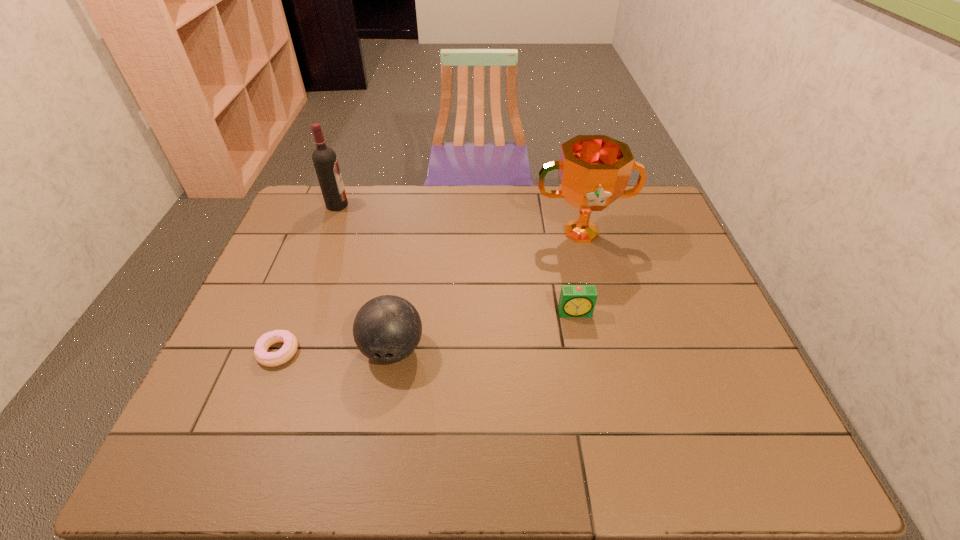
At what (x,y) coordinates should I click in order to perform the action: click on vacant space situated on the front-facing side of the third farthest object. Please return your answer as a coordinate pair (x, y). This screenshot has width=960, height=540. Looking at the image, I should click on (592, 399).

The image size is (960, 540). Find the location of `vacant space located on the right of the doughnut`. vacant space located on the right of the doughnut is located at coordinates (367, 352).

Locate an element on the screen. This screenshot has width=960, height=540. wine bottle positioned at the far edge is located at coordinates (325, 161).

Image resolution: width=960 pixels, height=540 pixels. I want to click on award present at the far edge, so click(x=593, y=170).

This screenshot has width=960, height=540. In order to click on wine bottle that is positioned at the left edge in this screenshot , I will do `click(325, 161)`.

At what (x,y) coordinates should I click in order to perform the action: click on doughnut that is at the left edge. Please return your answer as a coordinate pair (x, y). The height and width of the screenshot is (540, 960). Looking at the image, I should click on (269, 359).

Locate an element on the screen. The width and height of the screenshot is (960, 540). object present at the right edge is located at coordinates (593, 170).

Where is `object that is at the far left corner`? object that is at the far left corner is located at coordinates (325, 161).

The image size is (960, 540). What are the coordinates of `object present at the far right corner` in the screenshot? It's located at [593, 170].

Where is `free region at the far edge of the desktop`? free region at the far edge of the desktop is located at coordinates (347, 226).